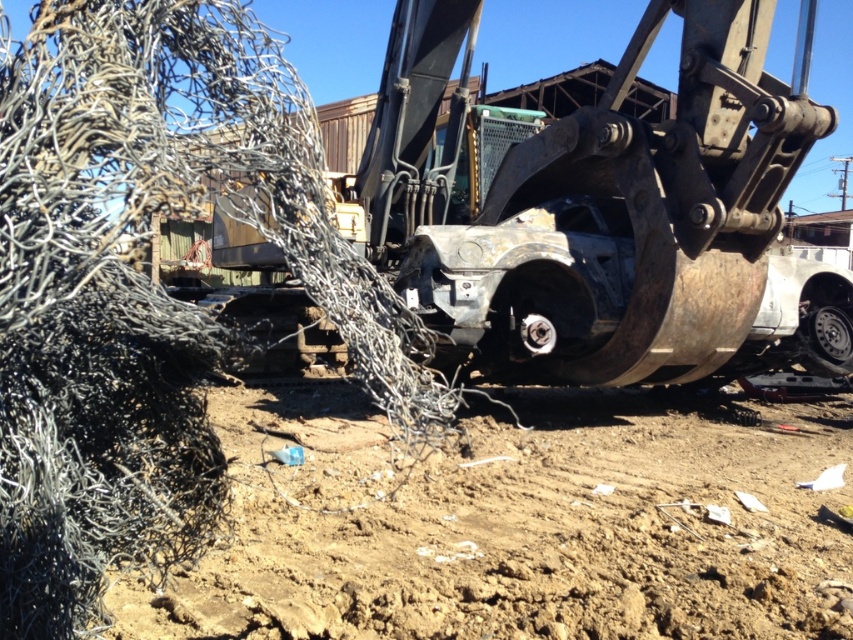
Question: Does brown soil at lower center have a smaller size compared to black rubber tire at lower right?

Choices:
 (A) yes
 (B) no

Answer: (B)

Question: Can you confirm if brown soil at lower center is positioned below black rubber tire at lower right?

Choices:
 (A) yes
 (B) no

Answer: (A)

Question: Which point is closer to the camera?

Choices:
 (A) brown soil at lower center
 (B) black rubber tire at lower right

Answer: (A)

Question: Which point is closer to the camera taking this photo?

Choices:
 (A) (825, 435)
 (B) (831, 314)

Answer: (A)

Question: Can you confirm if brown soil at lower center is bigger than black rubber tire at lower right?

Choices:
 (A) no
 (B) yes

Answer: (B)

Question: Which of the following is the closest to the observer?

Choices:
 (A) (811, 320)
 (B) (590, 403)

Answer: (A)